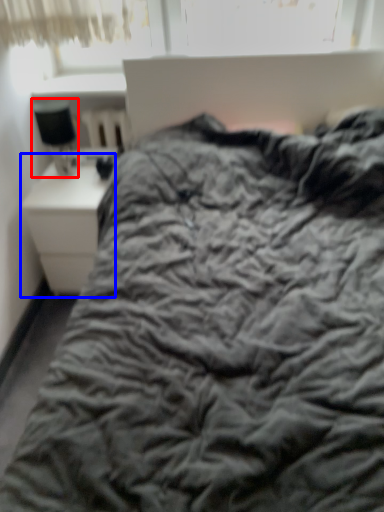
Question: Which point is further to the camera, table lamp (highlighted by a red box) or nightstand (highlighted by a blue box)?

Choices:
 (A) table lamp
 (B) nightstand

Answer: (B)